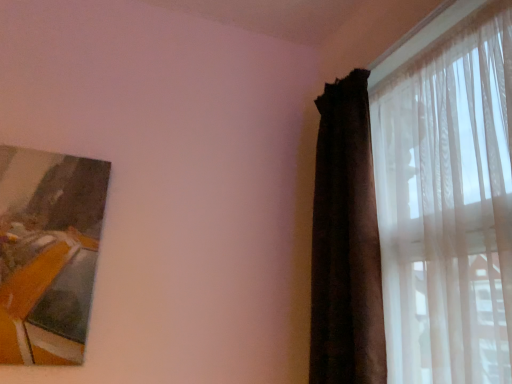
Question: Is the depth of dark velvet curtain at right, which ranks as the 2th curtain in right-to-left order, greater than that of translucent sheer curtain at right, the 2th curtain when ordered from left to right?

Choices:
 (A) yes
 (B) no

Answer: (A)

Question: Does dark velvet curtain at right, which ranks as the 2th curtain in right-to-left order, have a greater width compared to translucent sheer curtain at right, the 2th curtain when ordered from left to right?

Choices:
 (A) yes
 (B) no

Answer: (A)

Question: From the image's perspective, does dark velvet curtain at right, which ranks as the 2th curtain in right-to-left order, appear lower than translucent sheer curtain at right, placed as the first curtain when sorted from right to left?

Choices:
 (A) yes
 (B) no

Answer: (A)

Question: From the image's perspective, is dark velvet curtain at right, which ranks as the 2th curtain in right-to-left order, located above translucent sheer curtain at right, the 2th curtain when ordered from left to right?

Choices:
 (A) no
 (B) yes

Answer: (A)

Question: Does dark velvet curtain at right, placed as the 1th curtain when sorted from left to right, appear on the right side of translucent sheer curtain at right, the 2th curtain when ordered from left to right?

Choices:
 (A) no
 (B) yes

Answer: (A)

Question: Is point (318, 258) positioned closer to the camera than point (343, 291)?

Choices:
 (A) farther
 (B) closer

Answer: (A)

Question: From the image's perspective, is dark velvet curtain at right, placed as the 1th curtain when sorted from left to right, located above or below translucent sheer curtain at right, the 2th curtain when ordered from left to right?

Choices:
 (A) below
 (B) above

Answer: (A)

Question: Considering the positions of dark velvet curtain at right, placed as the 1th curtain when sorted from left to right, and translucent sheer curtain at right, placed as the first curtain when sorted from right to left, in the image, is dark velvet curtain at right, placed as the 1th curtain when sorted from left to right, wider or thinner than translucent sheer curtain at right, placed as the first curtain when sorted from right to left,?

Choices:
 (A) thin
 (B) wide

Answer: (B)

Question: In the image, is dark velvet curtain at right, placed as the 1th curtain when sorted from left to right, on the left side or the right side of translucent sheer curtain at right, placed as the first curtain when sorted from right to left?

Choices:
 (A) left
 (B) right

Answer: (A)

Question: Considering the positions of dark velvet curtain at right, placed as the 1th curtain when sorted from left to right, and wooden frame at upper left in the image, is dark velvet curtain at right, placed as the 1th curtain when sorted from left to right, wider or thinner than wooden frame at upper left?

Choices:
 (A) wide
 (B) thin

Answer: (A)

Question: From the image's perspective, is dark velvet curtain at right, placed as the 1th curtain when sorted from left to right, located above or below wooden frame at upper left?

Choices:
 (A) above
 (B) below

Answer: (A)

Question: In the image, is dark velvet curtain at right, which ranks as the 2th curtain in right-to-left order, on the left side or the right side of wooden frame at upper left?

Choices:
 (A) left
 (B) right

Answer: (B)

Question: Looking at the image, does dark velvet curtain at right, placed as the 1th curtain when sorted from left to right, seem bigger or smaller compared to wooden frame at upper left?

Choices:
 (A) small
 (B) big

Answer: (B)

Question: In terms of size, does translucent sheer curtain at right, placed as the first curtain when sorted from right to left, appear bigger or smaller than wooden frame at upper left?

Choices:
 (A) big
 (B) small

Answer: (A)

Question: Considering the positions of translucent sheer curtain at right, placed as the first curtain when sorted from right to left, and wooden frame at upper left in the image, is translucent sheer curtain at right, placed as the first curtain when sorted from right to left, wider or thinner than wooden frame at upper left?

Choices:
 (A) thin
 (B) wide

Answer: (B)